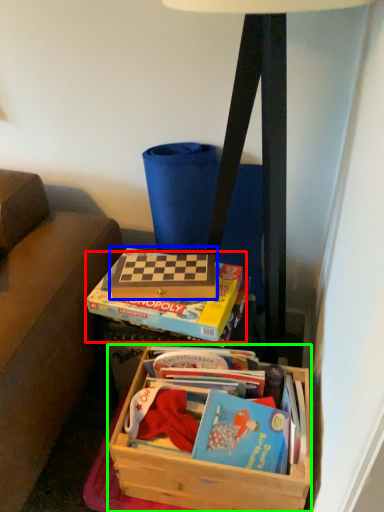
Question: Based on their relative distances, which object is farther from paperback book (highlighted by a red box)? Choose from paperback book (highlighted by a blue box) and box (highlighted by a green box).

Choices:
 (A) paperback book
 (B) box

Answer: (B)